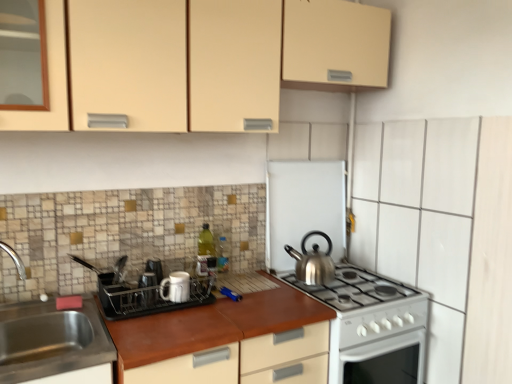
This screenshot has width=512, height=384. What do you see at coordinates (145, 292) in the screenshot?
I see `white matte dish rack at center, which appears as the first appliance when viewed from the front` at bounding box center [145, 292].

This screenshot has height=384, width=512. What do you see at coordinates (54, 344) in the screenshot? I see `stainless steel sink at lower left` at bounding box center [54, 344].

Find the location of a particular element. This screenshot has height=384, width=512. white ceramic mug at center, arranged as the second appliance when viewed from the left is located at coordinates (176, 287).

What is the approximate width of white ceramic mug at center, acting as the 2th appliance starting from the front?

3.50 inches.

In order to click on silver metallic kettle at center-right in this screenshot , I will do `click(313, 262)`.

Where is `white matte dish rack at center, which appears as the first appliance when viewed from the front`? This screenshot has height=384, width=512. white matte dish rack at center, which appears as the first appliance when viewed from the front is located at coordinates coord(145,292).

Between brown leather countertop at center and white matte dish rack at center, which appears as the first appliance when viewed from the front, which one has smaller width?

white matte dish rack at center, which appears as the first appliance when viewed from the front, is thinner.

Is point (192, 341) closer or farther from the camera than point (131, 310)?

Point (192, 341) is closer to the camera than point (131, 310).

Who is shorter, brown leather countertop at center or white matte dish rack at center, the 3th appliance in the back-to-front sequence?

Standing shorter between the two is white matte dish rack at center, the 3th appliance in the back-to-front sequence.

Could you tell me if brown leather countertop at center is facing white matte dish rack at center, which appears as the first appliance when viewed from the front?

No, brown leather countertop at center does not turn towards white matte dish rack at center, which appears as the first appliance when viewed from the front.

Between stainless steel sink at lower left and green glass bottle at center, which one appears on the left side from the viewer's perspective?

Positioned to the left is stainless steel sink at lower left.

Considering the sizes of stainless steel sink at lower left and green glass bottle at center in the image, is stainless steel sink at lower left taller or shorter than green glass bottle at center?

stainless steel sink at lower left is shorter than green glass bottle at center.

Between stainless steel sink at lower left and green glass bottle at center, which one has smaller size?

Smaller between the two is green glass bottle at center.

From the image's perspective, is stainless steel sink at lower left located beneath green glass bottle at center?

Indeed, from the image's perspective, stainless steel sink at lower left is shown beneath green glass bottle at center.

Based on the photo, which of these two, brown leather countertop at center or green glass bottle at center, is wider?

brown leather countertop at center is wider.

Based on the photo, are brown leather countertop at center and green glass bottle at center beside each other?

No, brown leather countertop at center is not next to green glass bottle at center.

Is brown leather countertop at center shorter than green glass bottle at center?

In fact, brown leather countertop at center may be taller than green glass bottle at center.

From a real-world perspective, is brown leather countertop at center located beneath green glass bottle at center?

Indeed, from a real-world perspective, brown leather countertop at center is positioned beneath green glass bottle at center.

Does matte beige cabinet at upper center appear on the left side of green glass bottle at center?

No.

From a real-world perspective, does matte beige cabinet at upper center sit lower than green glass bottle at center?

Actually, matte beige cabinet at upper center is physically above green glass bottle at center in the real world.

Between matte beige cabinet at upper center and green glass bottle at center, which one has smaller size?

green glass bottle at center is smaller.

Do you think matte beige cabinet at upper center is within green glass bottle at center, or outside of it?

matte beige cabinet at upper center is outside green glass bottle at center.

In the image, is white matte dish rack at center, which appears as the first appliance when viewed from the front, positioned in front of or behind silver metallic kettle at center-right?

In the image, white matte dish rack at center, which appears as the first appliance when viewed from the front, appears in front of silver metallic kettle at center-right.

From the picture: From a real-world perspective, is white matte dish rack at center, the 3th appliance in the back-to-front sequence, beneath silver metallic kettle at center-right?

Yes, from a real-world perspective, white matte dish rack at center, the 3th appliance in the back-to-front sequence, is beneath silver metallic kettle at center-right.

Looking at this image, is white matte dish rack at center, which appears as the first appliance when viewed from the front, inside the boundaries of silver metallic kettle at center-right, or outside?

white matte dish rack at center, which appears as the first appliance when viewed from the front, is not inside silver metallic kettle at center-right, it's outside.

How much distance is there between white matte dish rack at center, the third appliance in the right-to-left sequence, and silver metallic kettle at center-right?

white matte dish rack at center, the third appliance in the right-to-left sequence, and silver metallic kettle at center-right are 69.02 centimeters apart.

Is brown leather countertop at center turned away from white ceramic mug at center, acting as the 2th appliance starting from the front?

No, brown leather countertop at center is not facing away from white ceramic mug at center, acting as the 2th appliance starting from the front.

Considering the relative sizes of brown leather countertop at center and white ceramic mug at center, arranged as the 2th appliance when viewed from the back, in the image provided, is brown leather countertop at center shorter than white ceramic mug at center, arranged as the 2th appliance when viewed from the back,?

No, brown leather countertop at center is not shorter than white ceramic mug at center, arranged as the 2th appliance when viewed from the back.

From a real-world perspective, is brown leather countertop at center positioned over white ceramic mug at center, arranged as the 2th appliance when viewed from the back, based on gravity?

No, from a real-world perspective, brown leather countertop at center is not above white ceramic mug at center, arranged as the 2th appliance when viewed from the back.

How many degrees apart are the facing directions of brown leather countertop at center and white ceramic mug at center, acting as the 2th appliance starting from the front?

They differ by 1.46e-05 degrees in their facing directions.

Is stainless steel sink at lower left behind satin silver kettle at center, the 3th appliance from the left?

No, stainless steel sink at lower left is closer to the viewer.

From the image's perspective, which one is positioned lower, stainless steel sink at lower left or satin silver kettle at center, marked as the third appliance in a front-to-back arrangement?

stainless steel sink at lower left.

How many degrees apart are the facing directions of stainless steel sink at lower left and satin silver kettle at center, marked as the third appliance in a front-to-back arrangement?

The angle between the facing direction of stainless steel sink at lower left and the facing direction of satin silver kettle at center, marked as the third appliance in a front-to-back arrangement, is 1.07 degrees.

Identify the location of the 2nd appliance to the left when counting from the brown leather countertop at center. The width and height of the screenshot is (512, 384). (145, 292).

In the image, there is a stainless steel sink at lower left. At what (x,y) coordinates should I click in order to perform the action: click on bottle above it (from the image's perspective). Please return your answer as a coordinate pair (x, y). The image size is (512, 384). Looking at the image, I should click on (205, 250).

When comparing their distances from silver metallic kettle at center-right, does green glass bottle at center or matte beige cabinet at upper center seem further?

matte beige cabinet at upper center lies further to silver metallic kettle at center-right than the other object.

From the image, which object appears to be farther from matte beige cabinet at upper center, silver metallic kettle at center-right or white ceramic mug at center, the 2th appliance positioned from the right?

silver metallic kettle at center-right lies further to matte beige cabinet at upper center than the other object.

From the image, which object appears to be farther from matte beige cabinet at upper center, stainless steel sink at lower left or white matte dish rack at center, which appears as the first appliance when viewed from the front?

stainless steel sink at lower left lies further to matte beige cabinet at upper center than the other object.

Looking at the image, which one is located closer to white ceramic mug at center, arranged as the second appliance when viewed from the left, white matte dish rack at center, which appears as the first appliance when viewed from the front, or green glass bottle at center?

white matte dish rack at center, which appears as the first appliance when viewed from the front, is positioned closer to the anchor white ceramic mug at center, arranged as the second appliance when viewed from the left.

Based on their spatial positions, is green glass bottle at center or satin silver kettle at center, marked as the third appliance in a front-to-back arrangement, closer to stainless steel sink at lower left?

green glass bottle at center lies closer to stainless steel sink at lower left than the other object.

Considering their positions, is satin silver kettle at center, the 3th appliance from the left, positioned further to green glass bottle at center than matte beige cabinet at upper center?

The object further to green glass bottle at center is matte beige cabinet at upper center.

From the image, which object appears to be farther from satin silver kettle at center, the 3th appliance from the left, stainless steel sink at lower left or white ceramic mug at center, acting as the 2th appliance starting from the front?

Among the two, stainless steel sink at lower left is located further to satin silver kettle at center, the 3th appliance from the left.

Estimate the real-world distances between objects in this image. Which object is further from green glass bottle at center, satin silver kettle at center, the 3th appliance from the left, or white matte dish rack at center, the third appliance in the right-to-left sequence?

satin silver kettle at center, the 3th appliance from the left.

Identify the location of kitchen appliance between stainless steel sink at lower left and satin silver kettle at center, marked as the third appliance in a front-to-back arrangement. The height and width of the screenshot is (384, 512). pos(313,262).

What are the coordinates of `kitchen appliance situated between white matte dish rack at center, the 3th appliance in the back-to-front sequence, and satin silver kettle at center, which appears as the first appliance when viewed from the back, from left to right` in the screenshot? It's located at (313, 262).

Image resolution: width=512 pixels, height=384 pixels. Identify the location of bottle located between brown leather countertop at center and satin silver kettle at center, arranged as the 1th appliance when viewed from the right, in the depth direction. (205, 250).

Where is `appliance between white matte dish rack at center, the third appliance in the right-to-left sequence, and satin silver kettle at center, marked as the third appliance in a front-to-back arrangement, from left to right`? This screenshot has height=384, width=512. appliance between white matte dish rack at center, the third appliance in the right-to-left sequence, and satin silver kettle at center, marked as the third appliance in a front-to-back arrangement, from left to right is located at coordinates (176, 287).